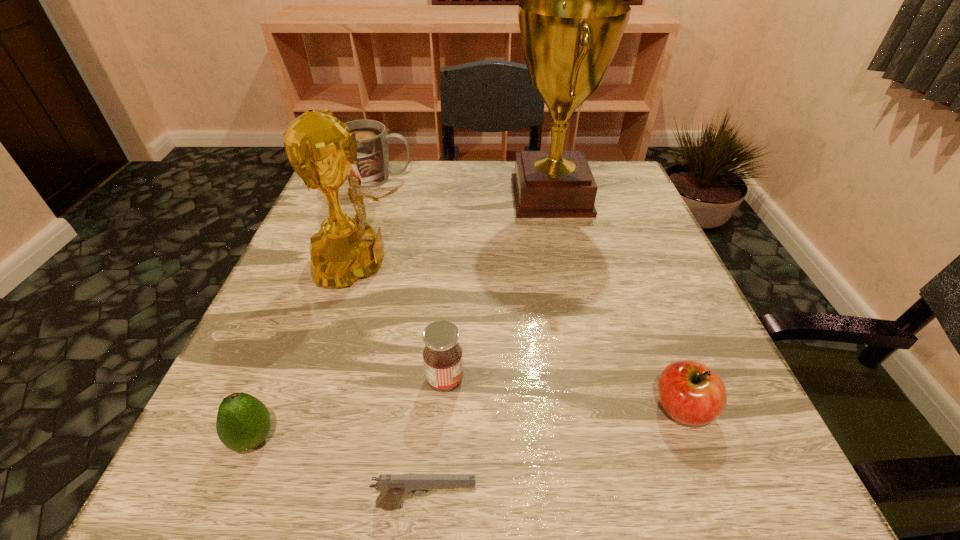
Where is `the right award`? This screenshot has height=540, width=960. the right award is located at coordinates (571, 23).

You are a GUI agent. You are given a task and a screenshot of the screen. Output one action in this format:
    pyautogui.click(x=<x>, y=<y>)
    Task: Click on the tallest object
    Image resolution: width=960 pixels, height=540 pixels.
    Given the screenshot: What is the action you would take?
    pyautogui.click(x=571, y=23)

The image size is (960, 540). What are the coordinates of `the shorter award` in the screenshot? It's located at (319, 147).

Where is `the sixth shortest object`? the sixth shortest object is located at coordinates (319, 147).

At what (x,y) coordinates should I click in order to perform the action: click on the fifth shortest object. Please return your answer as a coordinate pair (x, y). This screenshot has width=960, height=540. Looking at the image, I should click on (372, 169).

Locate an element on the screen. This screenshot has height=540, width=960. jam is located at coordinates (442, 355).

The image size is (960, 540). Find the location of `avocado`. avocado is located at coordinates (243, 422).

I want to click on apple, so click(691, 393).

Find the location of a particular element. the nearest object is located at coordinates (394, 488).

Image resolution: width=960 pixels, height=540 pixels. In order to click on vacant space located 0.340m on the plaque of the right award in this screenshot , I will do `click(373, 197)`.